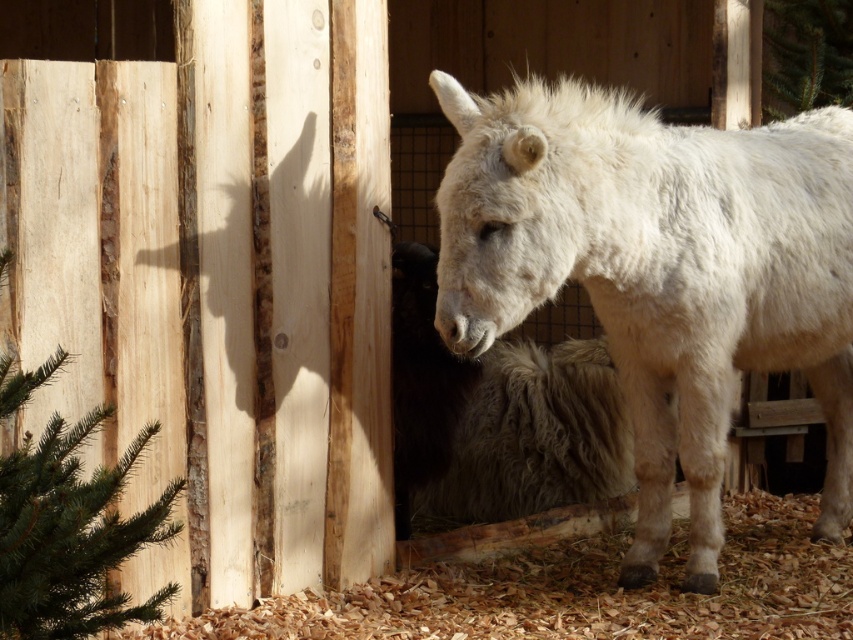
Question: Which point appears farthest from the camera in this image?

Choices:
 (A) (440, 298)
 (B) (416, 360)

Answer: (B)

Question: Which point appears farthest from the camera in this image?

Choices:
 (A) (476, 424)
 (B) (672, 440)

Answer: (A)

Question: Does white woolen donkey at center lie in front of white woolly sheep at center?

Choices:
 (A) no
 (B) yes

Answer: (B)

Question: Is white woolen donkey at center to the right of white woolly sheep at center from the viewer's perspective?

Choices:
 (A) no
 (B) yes

Answer: (B)

Question: Is white woolen donkey at center wider than white woolly sheep at center?

Choices:
 (A) no
 (B) yes

Answer: (B)